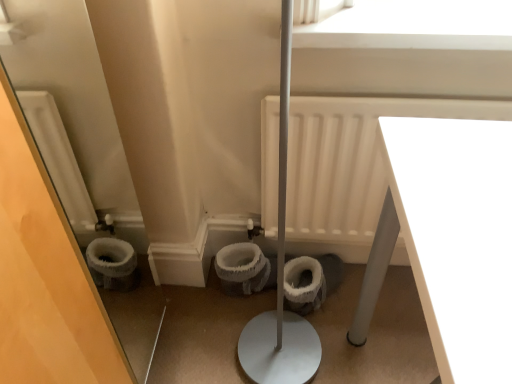
Question: Is white fuzzy toilet bowl at center, which is the 1th toilet bowl from left to right, positioned with its back to white glossy table at lower right?

Choices:
 (A) no
 (B) yes

Answer: (A)

Question: Is white fuzzy toilet bowl at center, placed as the second toilet bowl when sorted from right to left, to the right of white glossy table at lower right from the viewer's perspective?

Choices:
 (A) no
 (B) yes

Answer: (A)

Question: From the image's perspective, is white fuzzy toilet bowl at center, which is the 1th toilet bowl from left to right, below white glossy table at lower right?

Choices:
 (A) no
 (B) yes

Answer: (A)

Question: Does white fuzzy toilet bowl at center, which is the 1th toilet bowl from left to right, have a greater height compared to white glossy table at lower right?

Choices:
 (A) yes
 (B) no

Answer: (B)

Question: Is white fuzzy toilet bowl at center, which is the 1th toilet bowl from left to right, thinner than white glossy table at lower right?

Choices:
 (A) no
 (B) yes

Answer: (B)

Question: In the image, is white matte window screen at upper center on the left side or the right side of white matte radiator at center?

Choices:
 (A) left
 (B) right

Answer: (B)

Question: Considering the positions of point (455, 14) and point (473, 112), is point (455, 14) closer or farther from the camera than point (473, 112)?

Choices:
 (A) farther
 (B) closer

Answer: (B)

Question: Is white matte window screen at upper center wider or thinner than white matte radiator at center?

Choices:
 (A) thin
 (B) wide

Answer: (A)

Question: Looking at the image, does white matte window screen at upper center seem bigger or smaller compared to white matte radiator at center?

Choices:
 (A) small
 (B) big

Answer: (A)

Question: Would you say white matte window screen at upper center is to the left or to the right of white fluffy toilet bowl at center, the 2th toilet bowl in the left-to-right sequence, in the picture?

Choices:
 (A) left
 (B) right

Answer: (B)

Question: From a real-world perspective, is white matte window screen at upper center positioned above or below white fluffy toilet bowl at center, the 2th toilet bowl in the left-to-right sequence?

Choices:
 (A) above
 (B) below

Answer: (A)

Question: Considering the positions of point (440, 1) and point (285, 281), is point (440, 1) closer or farther from the camera than point (285, 281)?

Choices:
 (A) farther
 (B) closer

Answer: (B)

Question: Considering the positions of white matte window screen at upper center and white fluffy toilet bowl at center, which appears as the first toilet bowl when viewed from the right, in the image, is white matte window screen at upper center taller or shorter than white fluffy toilet bowl at center, which appears as the first toilet bowl when viewed from the right,?

Choices:
 (A) short
 (B) tall

Answer: (A)

Question: Looking at the image, does white glossy table at lower right seem bigger or smaller compared to white fluffy toilet bowl at center, the 2th toilet bowl in the left-to-right sequence?

Choices:
 (A) small
 (B) big

Answer: (B)

Question: Is white glossy table at lower right to the left or to the right of white fluffy toilet bowl at center, the 2th toilet bowl in the left-to-right sequence, in the image?

Choices:
 (A) left
 (B) right

Answer: (B)